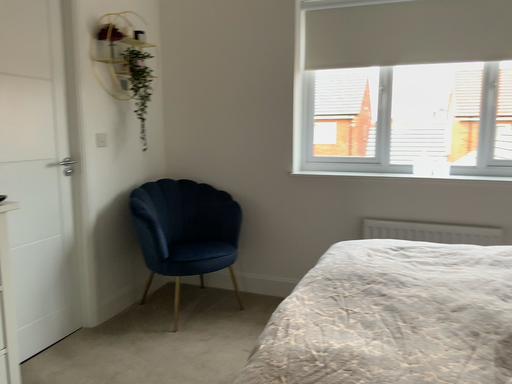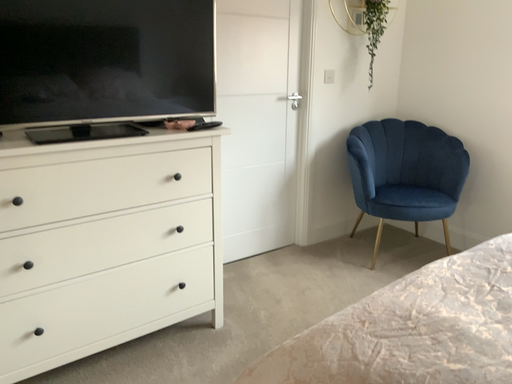
Question: Which way did the camera rotate in the video?

Choices:
 (A) rotated left
 (B) rotated right

Answer: (A)